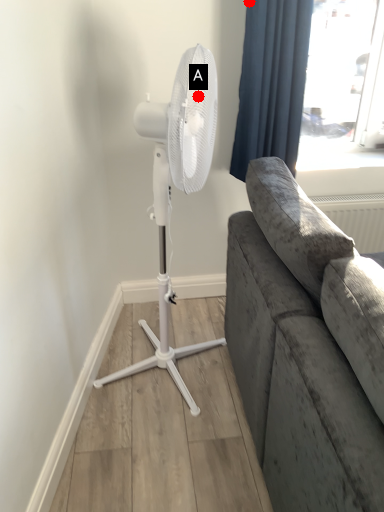
Question: Two points are circled on the image, labeled by A and B beside each circle. Among these points, which one is farthest from the camera?

Choices:
 (A) A is further
 (B) B is further

Answer: (B)